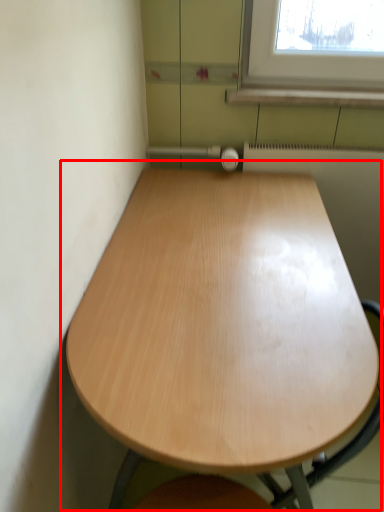
Question: Observing the image, what is the correct spatial positioning of table (annotated by the red box) in reference to radiator?

Choices:
 (A) right
 (B) left

Answer: (B)